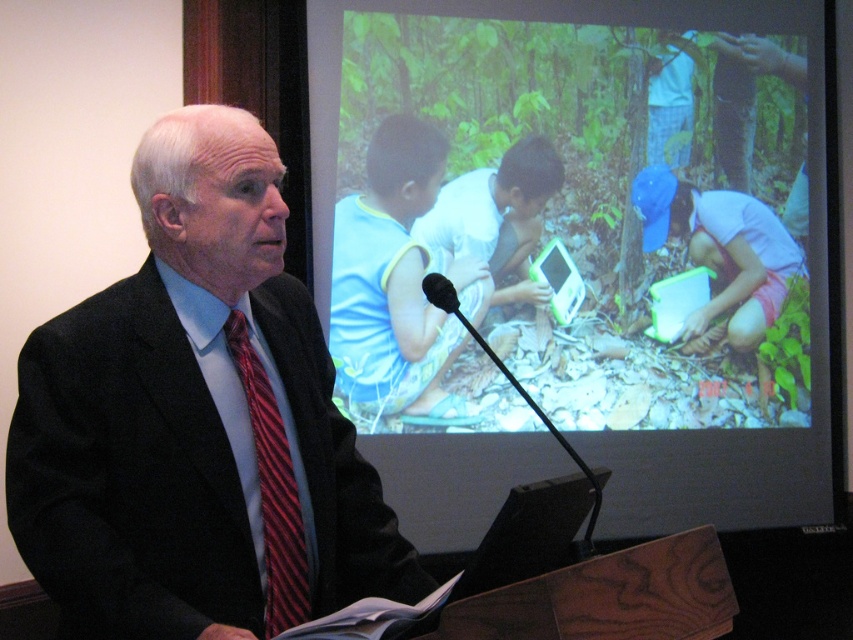
Question: From the image, what is the correct spatial relationship of white satin dress shirt at left in relation to black plastic microphone at center?

Choices:
 (A) right
 (B) left

Answer: (B)

Question: Which point is farther from the camera taking this photo?

Choices:
 (A) (131, 632)
 (B) (541, 339)
 (C) (531, 228)

Answer: (B)

Question: Considering the relative positions of white satin dress shirt at left and black plastic microphone at center in the image provided, where is white satin dress shirt at left located with respect to black plastic microphone at center?

Choices:
 (A) below
 (B) above

Answer: (A)

Question: Does black wool suit at left appear under white satin dress shirt at left?

Choices:
 (A) no
 (B) yes

Answer: (A)

Question: Which object is the closest to the matte plastic screen at upper right?

Choices:
 (A) black wool suit at left
 (B) white satin dress shirt at left
 (C) black plastic microphone at center
 (D) striped silk tie at left

Answer: (C)

Question: Which object appears farthest from the camera in this image?

Choices:
 (A) white satin dress shirt at left
 (B) striped silk tie at left
 (C) matte plastic screen at upper right

Answer: (C)